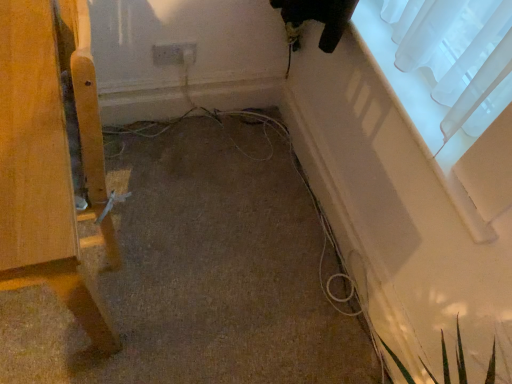
Question: Looking at their shapes, would you say transparent fabric at upper right is wider or thinner than white plastic electric outlet at center?

Choices:
 (A) thin
 (B) wide

Answer: (B)

Question: Considering the positions of point (419, 94) and point (193, 46), is point (419, 94) closer or farther from the camera than point (193, 46)?

Choices:
 (A) closer
 (B) farther

Answer: (A)

Question: Which of these objects is positioned closest to the white plastic electric outlet at center?

Choices:
 (A) transparent fabric at upper right
 (B) wooden chair leg at left

Answer: (A)

Question: Based on their relative distances, which object is farther from the transparent fabric at upper right?

Choices:
 (A) white plastic electric outlet at center
 (B) wooden chair leg at left

Answer: (B)